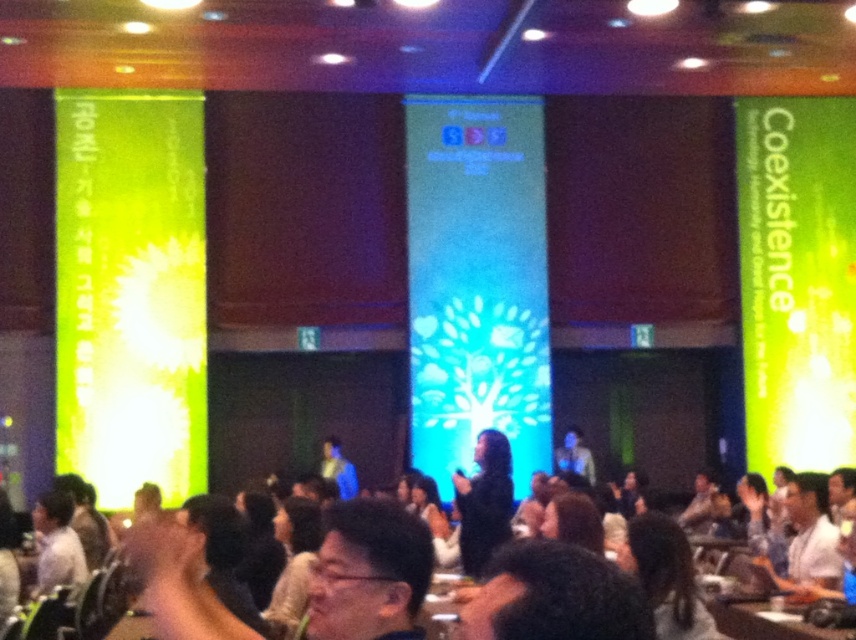
The height and width of the screenshot is (640, 856). In order to click on dark hair at center in this screenshot , I will do [556, 596].

Describe the element at coordinates (556, 596) in the screenshot. I see `dark hair at center` at that location.

I want to click on dark hair at center, so click(556, 596).